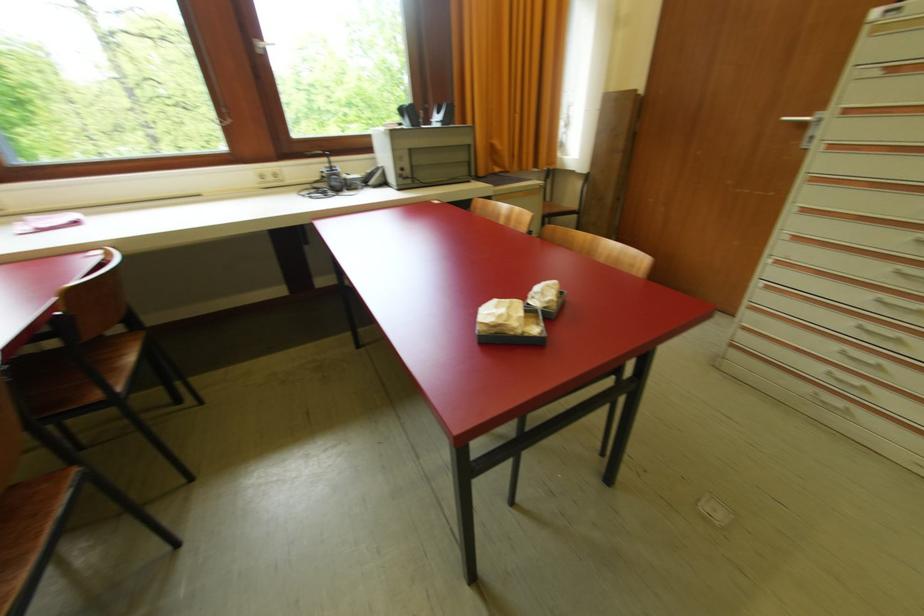
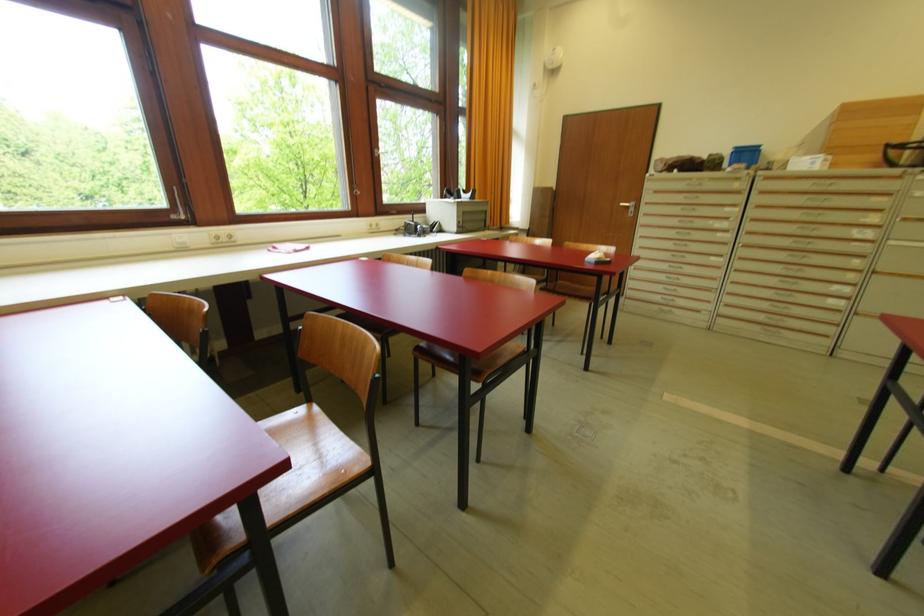
Locate, in the second image, the point that corresponds to pixel 807 128 in the first image.

(629, 209)